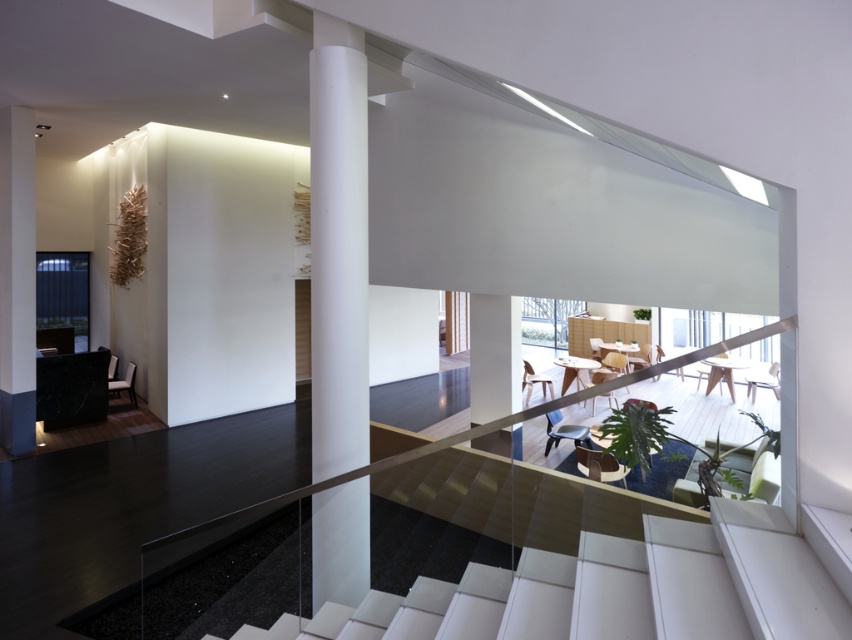
Question: Which point is closer to the camera taking this photo?

Choices:
 (A) (3, 256)
 (B) (355, 598)
 (C) (763, 611)

Answer: (C)

Question: Observing the image, what is the correct spatial positioning of white glossy column at center in reference to white matte column at upper left?

Choices:
 (A) below
 (B) above

Answer: (A)

Question: Which point is closer to the camera?

Choices:
 (A) white matte column at upper left
 (B) white glossy column at center

Answer: (B)

Question: Which point is farther to the camera?

Choices:
 (A) (337, 92)
 (B) (14, 150)
 (C) (258, 636)

Answer: (B)

Question: Can you confirm if white glossy stair at center is thinner than white matte column at upper left?

Choices:
 (A) yes
 (B) no

Answer: (B)

Question: Where is white glossy stair at center located in relation to white glossy column at center in the image?

Choices:
 (A) right
 (B) left

Answer: (A)